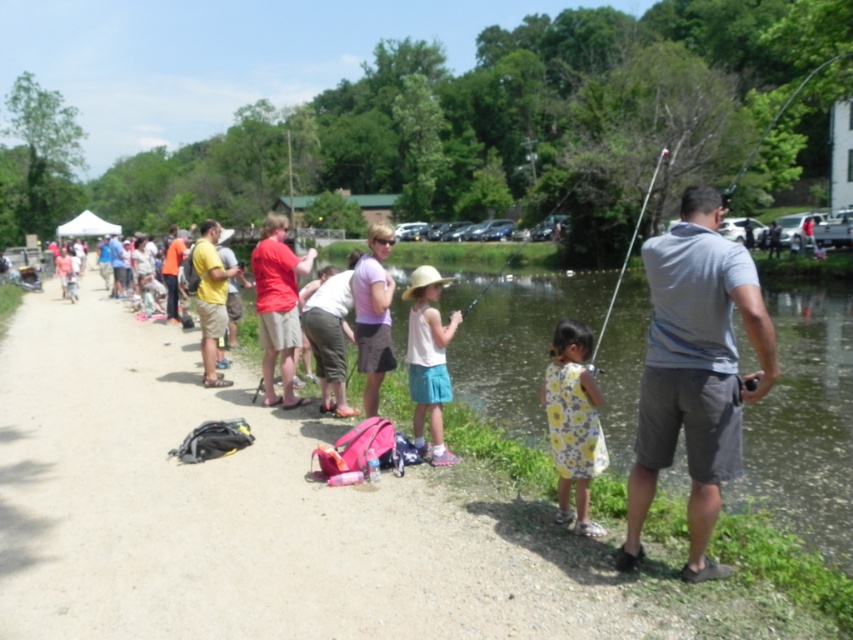
Question: Is matte gray gravel at center thinner than yellow t-shirt at center?

Choices:
 (A) yes
 (B) no

Answer: (B)

Question: Is white cotton shirt at center in front of yellow t-shirt at center?

Choices:
 (A) no
 (B) yes

Answer: (B)

Question: Estimate the real-world distances between objects in this image. Which object is farther from the yellow t-shirt at center?

Choices:
 (A) yellow floral dress at lower center
 (B) white cotton shirt at center
 (C) matte gray gravel at center

Answer: (A)

Question: Considering the real-world distances, which object is closest to the white cotton shirt at center?

Choices:
 (A) yellow floral dress at lower center
 (B) matte red shirt at center
 (C) gray cotton shirt at right

Answer: (A)

Question: Which point appears farthest from the camera in this image?

Choices:
 (A) (260, 324)
 (B) (639, 532)

Answer: (A)

Question: Does matte gray gravel at center have a larger size compared to gray cotton shirt at right?

Choices:
 (A) yes
 (B) no

Answer: (A)